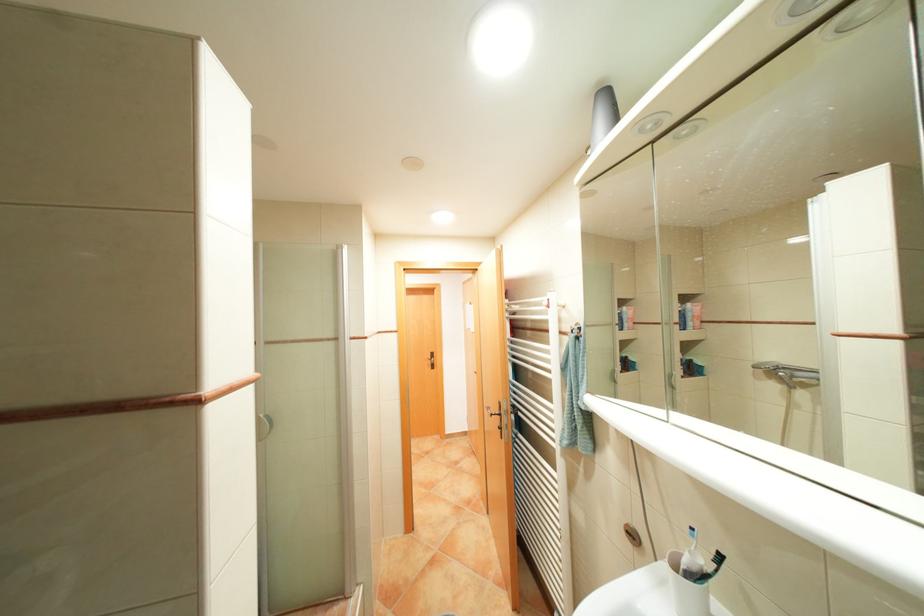
Image resolution: width=924 pixels, height=616 pixels. I want to click on white towel hook, so click(566, 318).